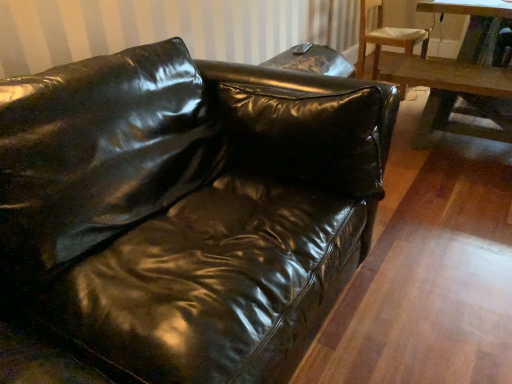
Question: Would you consider wooden chair at upper right to be distant from glossy leather couch at center?

Choices:
 (A) yes
 (B) no

Answer: (A)

Question: Is wooden chair at upper right positioned with its back to glossy leather couch at center?

Choices:
 (A) no
 (B) yes

Answer: (A)

Question: Is the position of wooden chair at upper right less distant than that of glossy leather couch at center?

Choices:
 (A) no
 (B) yes

Answer: (A)

Question: Is wooden chair at upper right smaller than glossy leather couch at center?

Choices:
 (A) no
 (B) yes

Answer: (B)

Question: Considering the relative sizes of wooden chair at upper right and glossy leather couch at center in the image provided, is wooden chair at upper right thinner than glossy leather couch at center?

Choices:
 (A) no
 (B) yes

Answer: (B)

Question: From the image's perspective, would you say wooden chair at upper right is positioned over glossy leather couch at center?

Choices:
 (A) no
 (B) yes

Answer: (B)

Question: Could you tell me if wooden table at right is turned towards glossy leather couch at center?

Choices:
 (A) no
 (B) yes

Answer: (A)

Question: Does wooden table at right have a lesser height compared to glossy leather couch at center?

Choices:
 (A) yes
 (B) no

Answer: (B)

Question: Considering the relative positions of wooden table at right and glossy leather couch at center in the image provided, is wooden table at right to the left of glossy leather couch at center from the viewer's perspective?

Choices:
 (A) no
 (B) yes

Answer: (A)

Question: Does wooden table at right have a lesser width compared to glossy leather couch at center?

Choices:
 (A) yes
 (B) no

Answer: (A)

Question: Is wooden table at right behind glossy leather couch at center?

Choices:
 (A) yes
 (B) no

Answer: (A)

Question: From a real-world perspective, is wooden table at right located higher than glossy leather couch at center?

Choices:
 (A) yes
 (B) no

Answer: (A)

Question: Is the position of wooden chair at upper right less distant than that of wooden table at right?

Choices:
 (A) yes
 (B) no

Answer: (B)